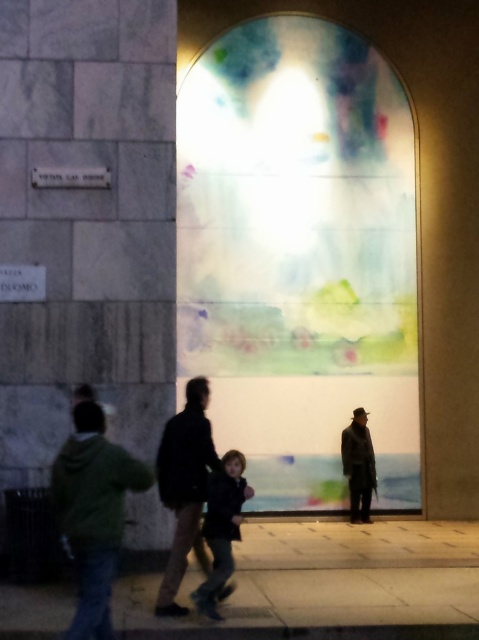
Question: Which point is closer to the camera?

Choices:
 (A) (365, 490)
 (B) (230, 515)
 (C) (169, 141)
 (D) (91, 592)

Answer: (D)

Question: Can you confirm if smooth concrete pavement at lower center is bigger than dark brown leather jacket at center?

Choices:
 (A) yes
 (B) no

Answer: (B)

Question: Is smooth concrete pavement at lower center wider than dark brown leather coat at right?

Choices:
 (A) yes
 (B) no

Answer: (A)

Question: Is marble stone pillar at left below dark brown leather coat at right?

Choices:
 (A) no
 (B) yes

Answer: (A)

Question: Which point is farther to the camera?

Choices:
 (A) smooth concrete pavement at lower center
 (B) marble stone pillar at left
 (C) green matte jacket at lower left

Answer: (B)

Question: Which of the following is the farthest from the observer?

Choices:
 (A) (x=98, y=496)
 (B) (x=252, y=609)
 (C) (x=75, y=83)
 (D) (x=354, y=422)

Answer: (D)